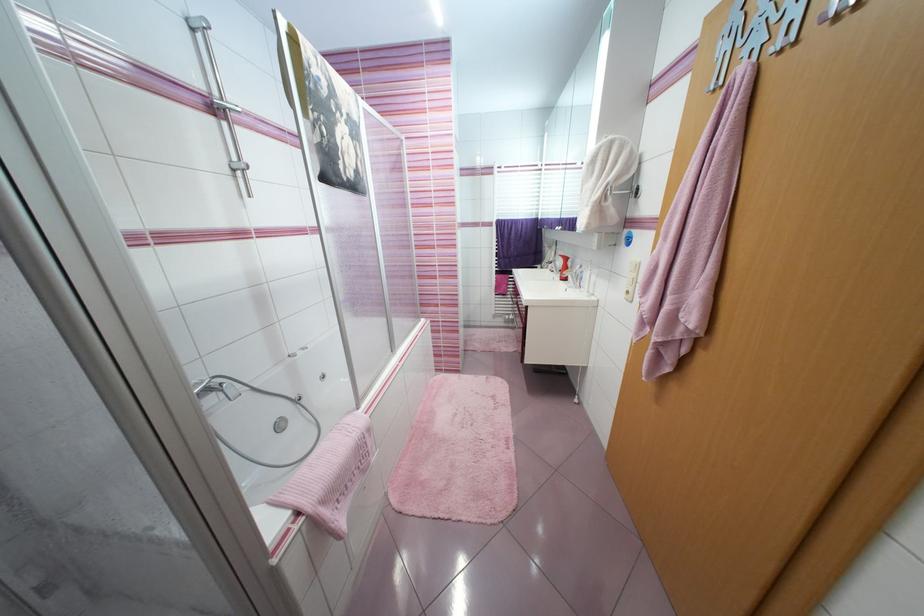
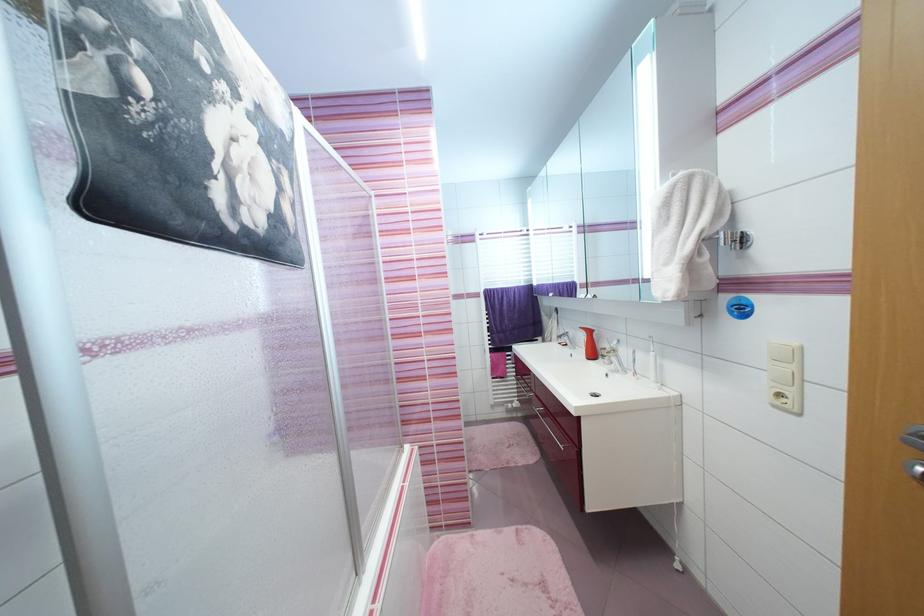
Question: In a continuous first-person perspective shot, in which direction is the camera moving?

Choices:
 (A) Left
 (B) Right
 (C) Forward
 (D) Backward

Answer: (C)